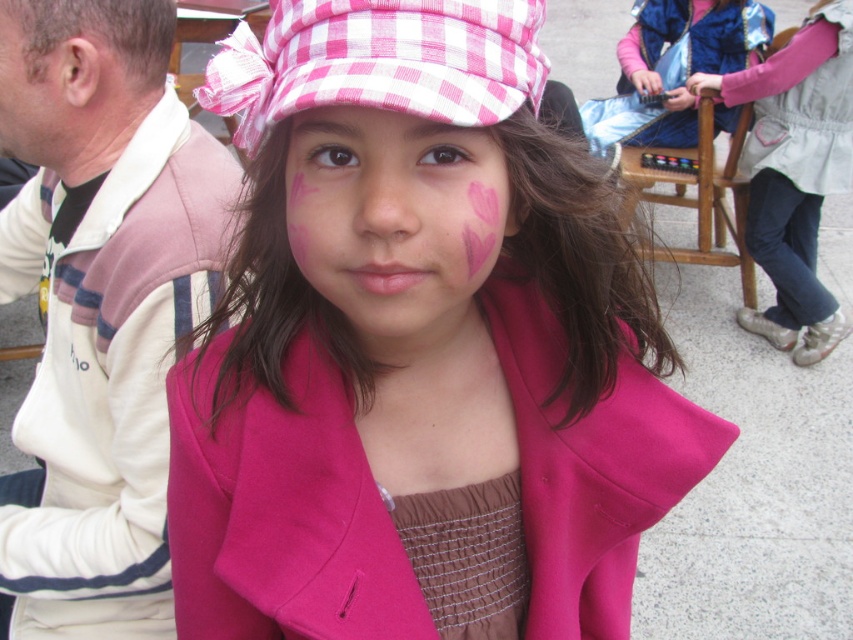
What is the object located at the coordinates point [415,340] in the image?

The point [415,340] indicates the pink matte hat at upper center.

You are a photographer trying to capture the girl in the scene. You notice the pink checkered fabric hat at upper center and the dry skin at left. Which object is positioned higher in the image?

The dry skin at left is positioned higher than the pink checkered fabric hat at upper center.